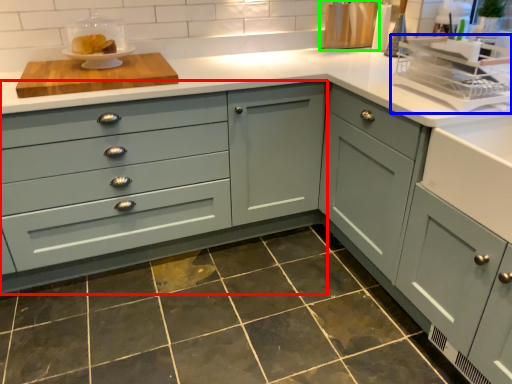
Question: Considering the real-world distances, which object is closest to cabinetry (highlighted by a red box)? appliance (highlighted by a blue box) or appliance (highlighted by a green box).

Choices:
 (A) appliance
 (B) appliance

Answer: (A)